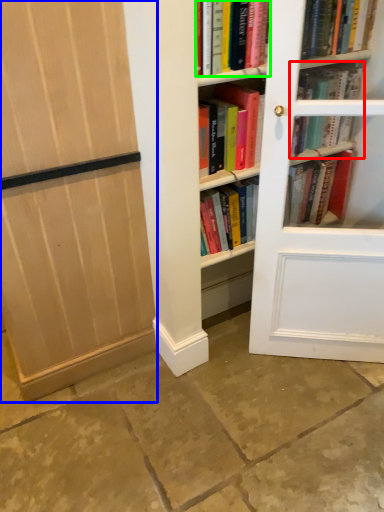
Question: Which is farther away from book (highlighted by a red box)? door (highlighted by a blue box) or book (highlighted by a green box)?

Choices:
 (A) door
 (B) book

Answer: (A)